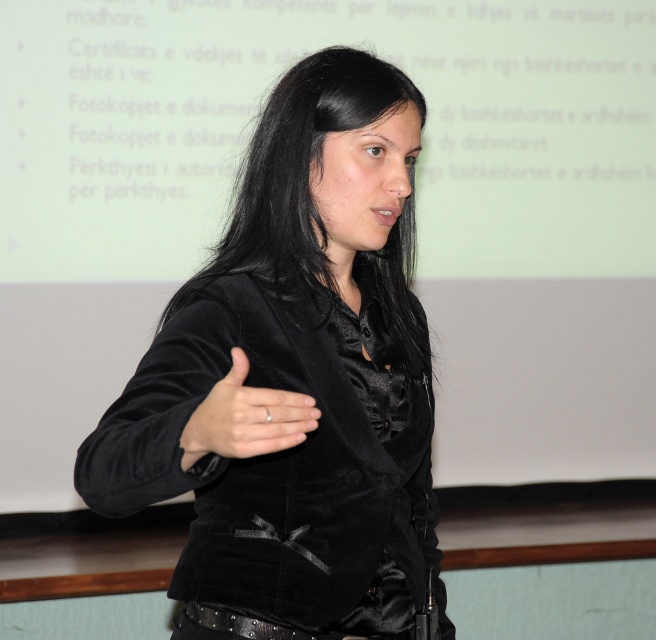
Consider the image. You are an observer in the room. You notice the black velvet hair at center and the satin black hand at center. Which object is taller?

The black velvet hair at center is taller than the satin black hand at center according to the description.